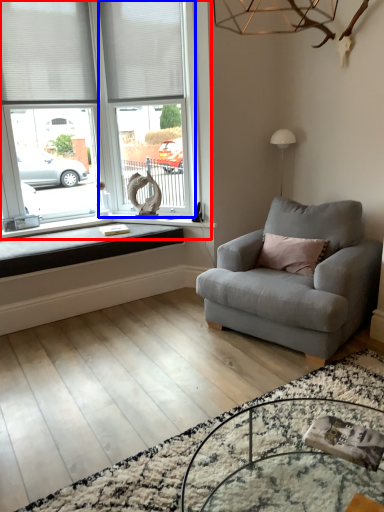
Question: Which object is further to the camera taking this photo, window (highlighted by a red box) or window frame (highlighted by a blue box)?

Choices:
 (A) window
 (B) window frame

Answer: (B)